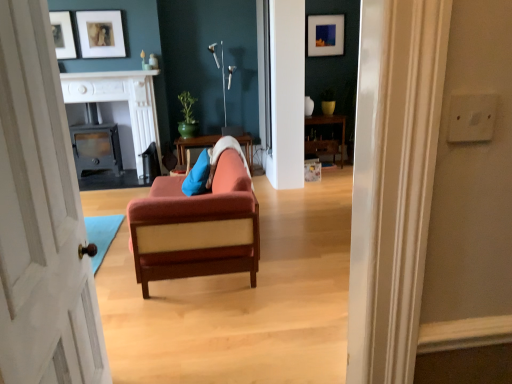
Question: Is wooden table at center directly adjacent to matte black wood stove at center, arranged as the 2th fireplace when viewed from the left?

Choices:
 (A) yes
 (B) no

Answer: (B)

Question: Is wooden table at center wider than matte black wood stove at center, the 1th fireplace from the right?

Choices:
 (A) no
 (B) yes

Answer: (A)

Question: From a real-world perspective, does wooden table at center stand above matte black wood stove at center, arranged as the 2th fireplace when viewed from the left?

Choices:
 (A) no
 (B) yes

Answer: (A)

Question: Can you confirm if wooden table at center is smaller than matte black wood stove at center, arranged as the 2th fireplace when viewed from the left?

Choices:
 (A) no
 (B) yes

Answer: (B)

Question: Is wooden table at center facing away from matte black wood stove at center, arranged as the 2th fireplace when viewed from the left?

Choices:
 (A) no
 (B) yes

Answer: (A)

Question: Considering the relative sizes of wooden table at center and matte black wood stove at center, the 1th fireplace from the right, in the image provided, is wooden table at center bigger than matte black wood stove at center, the 1th fireplace from the right,?

Choices:
 (A) yes
 (B) no

Answer: (B)

Question: Does blue fabric pillow at center lie in front of matte orange couch at center?

Choices:
 (A) no
 (B) yes

Answer: (A)

Question: Is blue fabric pillow at center outside matte orange couch at center?

Choices:
 (A) no
 (B) yes

Answer: (A)

Question: Considering the relative sizes of blue fabric pillow at center and matte orange couch at center in the image provided, is blue fabric pillow at center smaller than matte orange couch at center?

Choices:
 (A) no
 (B) yes

Answer: (B)

Question: Is blue fabric pillow at center wider than matte orange couch at center?

Choices:
 (A) yes
 (B) no

Answer: (B)

Question: Would you say blue fabric pillow at center contains matte orange couch at center?

Choices:
 (A) yes
 (B) no

Answer: (B)

Question: Is matte orange couch at center at the back of blue fabric pillow at center?

Choices:
 (A) no
 (B) yes

Answer: (B)

Question: From the image's perspective, is matte black picture frame at upper center, which appears as the first picture frame when viewed from the back, above wooden table at center?

Choices:
 (A) no
 (B) yes

Answer: (B)